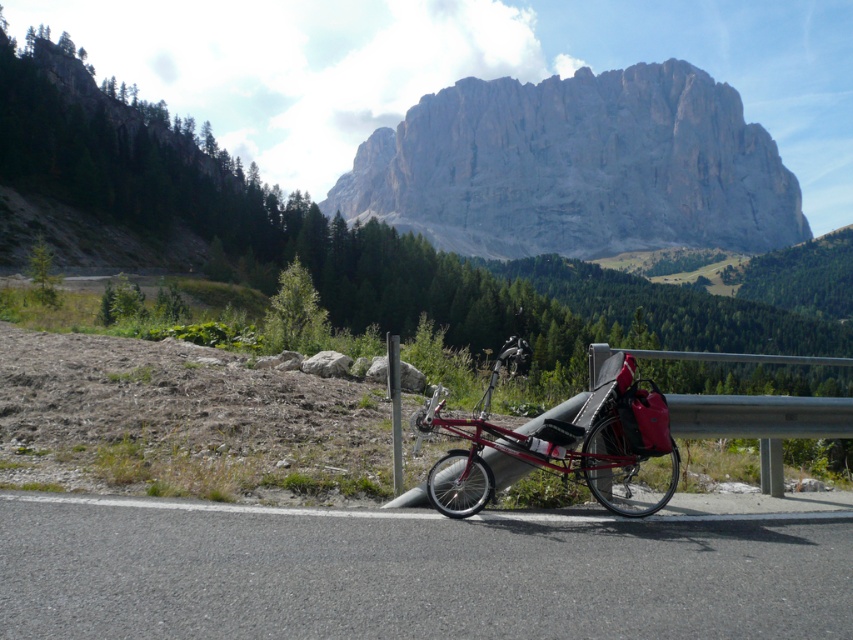
Is point (456, 592) positioned after point (397, 410)?

No, it is in front of (397, 410).

Between black asphalt road at lower center and metallic gray pole at center, which one is positioned lower?

black asphalt road at lower center is lower down.

Is point (486, 536) closer to camera compared to point (392, 372)?

Yes, point (486, 536) is in front of point (392, 372).

Where is `black asphalt road at lower center`? The height and width of the screenshot is (640, 853). black asphalt road at lower center is located at coordinates 410,573.

Can you confirm if metallic red bicycle at center is thinner than metallic gray pole at center?

No.

Who is higher up, metallic red bicycle at center or metallic gray pole at center?

metallic gray pole at center is above.

At what (x,y) coordinates should I click in order to perform the action: click on metallic red bicycle at center. Please return your answer as a coordinate pair (x, y). This screenshot has width=853, height=640. Looking at the image, I should click on (566, 444).

The width and height of the screenshot is (853, 640). In order to click on metallic red bicycle at center in this screenshot , I will do `click(566, 444)`.

Can you confirm if gray rocky mountain at upper center is positioned to the left of metallic gray pole at center?

In fact, gray rocky mountain at upper center is to the right of metallic gray pole at center.

Does gray rocky mountain at upper center have a smaller size compared to metallic gray pole at center?

No.

Where is `gray rocky mountain at upper center`? The height and width of the screenshot is (640, 853). gray rocky mountain at upper center is located at coordinates point(577,168).